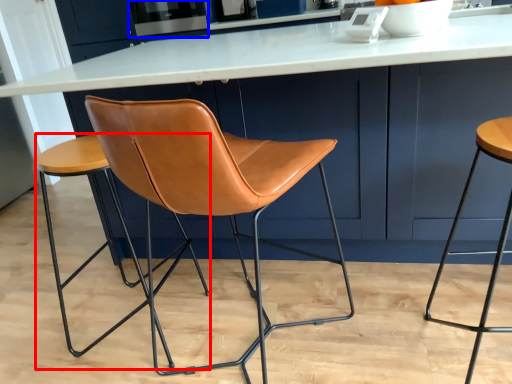
Question: Among these objects, which one is farthest to the camera, stool (highlighted by a red box) or appliance (highlighted by a blue box)?

Choices:
 (A) stool
 (B) appliance

Answer: (B)